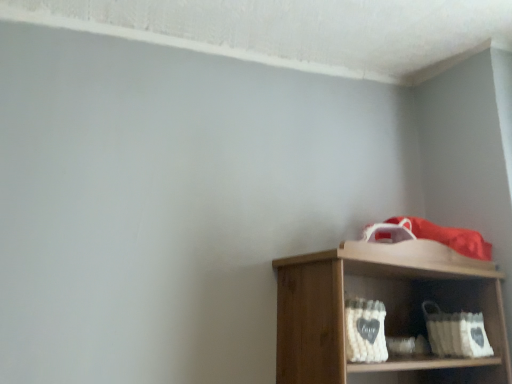
Question: Is white fabric basket at lower right, which is the second basket in left-to-right order, in front of or behind white woven basket at lower center, the 2th basket when ordered from back to front, in the image?

Choices:
 (A) behind
 (B) front

Answer: (A)

Question: From the image's perspective, relative to white woven basket at lower center, the 2th basket when ordered from back to front, is white fabric basket at lower right, the 2th basket from the front, above or below?

Choices:
 (A) below
 (B) above

Answer: (A)

Question: In terms of width, does white fabric basket at lower right, placed as the 1th basket when sorted from right to left, look wider or thinner when compared to white woven basket at lower center, the 2th basket when ordered from back to front?

Choices:
 (A) wide
 (B) thin

Answer: (A)

Question: Considering the positions of white woven basket at lower center, the first basket positioned from the front, and white fabric basket at lower right, positioned as the first basket in back-to-front order, in the image, is white woven basket at lower center, the first basket positioned from the front, bigger or smaller than white fabric basket at lower right, positioned as the first basket in back-to-front order,?

Choices:
 (A) big
 (B) small

Answer: (B)

Question: In terms of width, does white woven basket at lower center, the first basket positioned from the front, look wider or thinner when compared to white fabric basket at lower right, placed as the 1th basket when sorted from right to left?

Choices:
 (A) thin
 (B) wide

Answer: (A)

Question: From a real-world perspective, is white woven basket at lower center, the first basket in the left-to-right sequence, positioned above or below white fabric basket at lower right, which is the second basket in left-to-right order?

Choices:
 (A) below
 (B) above

Answer: (B)

Question: From the image's perspective, is white woven basket at lower center, the first basket in the left-to-right sequence, above or below white fabric basket at lower right, the 2th basket from the front?

Choices:
 (A) above
 (B) below

Answer: (A)